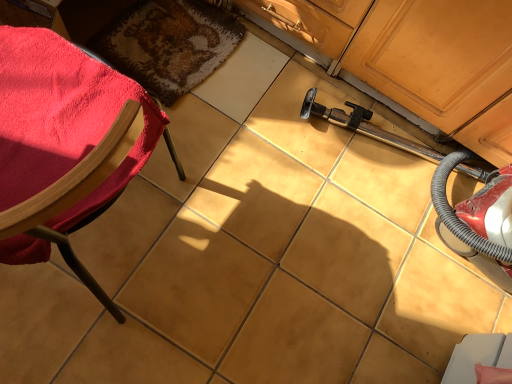
Question: Would you say shaggy brown rug at upper left contains velvet red chair at left?

Choices:
 (A) no
 (B) yes

Answer: (A)

Question: Can you confirm if shaggy brown rug at upper left is positioned to the right of velvet red chair at left?

Choices:
 (A) yes
 (B) no

Answer: (A)

Question: Is shaggy brown rug at upper left wider than velvet red chair at left?

Choices:
 (A) yes
 (B) no

Answer: (B)

Question: Is shaggy brown rug at upper left positioned in front of velvet red chair at left?

Choices:
 (A) no
 (B) yes

Answer: (A)

Question: From a real-world perspective, is shaggy brown rug at upper left positioned under velvet red chair at left based on gravity?

Choices:
 (A) no
 (B) yes

Answer: (B)

Question: Is shaggy brown rug at upper left not close to velvet red chair at left?

Choices:
 (A) no
 (B) yes

Answer: (A)

Question: Considering the relative sizes of velvet red chair at left and shaggy brown rug at upper left in the image provided, is velvet red chair at left shorter than shaggy brown rug at upper left?

Choices:
 (A) no
 (B) yes

Answer: (A)

Question: Is velvet red chair at left touching shaggy brown rug at upper left?

Choices:
 (A) no
 (B) yes

Answer: (A)

Question: Can you confirm if velvet red chair at left is bigger than shaggy brown rug at upper left?

Choices:
 (A) yes
 (B) no

Answer: (A)

Question: From the image's perspective, is velvet red chair at left above shaggy brown rug at upper left?

Choices:
 (A) no
 (B) yes

Answer: (A)

Question: Is velvet red chair at left positioned before shaggy brown rug at upper left?

Choices:
 (A) no
 (B) yes

Answer: (B)

Question: Considering the relative positions of velvet red chair at left and shaggy brown rug at upper left in the image provided, is velvet red chair at left to the right of shaggy brown rug at upper left from the viewer's perspective?

Choices:
 (A) yes
 (B) no

Answer: (B)

Question: Is velvet red chair at left bigger or smaller than shaggy brown rug at upper left?

Choices:
 (A) big
 (B) small

Answer: (A)